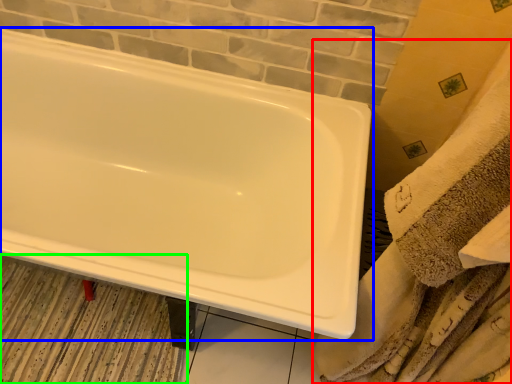
Question: Considering the real-world distances, which object is farthest from bath towel (highlighted by a red box)? bathtub (highlighted by a blue box) or bath mat (highlighted by a green box)?

Choices:
 (A) bathtub
 (B) bath mat

Answer: (B)